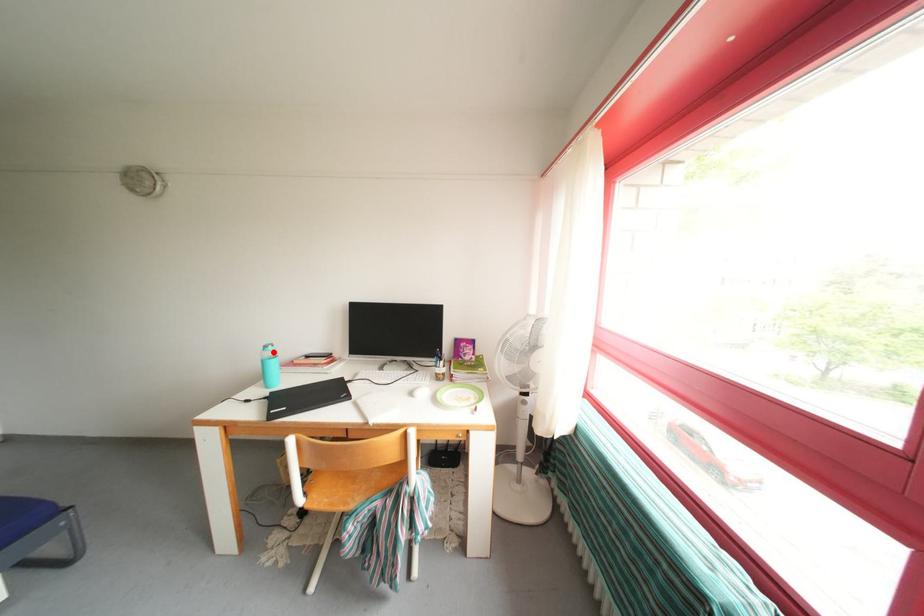
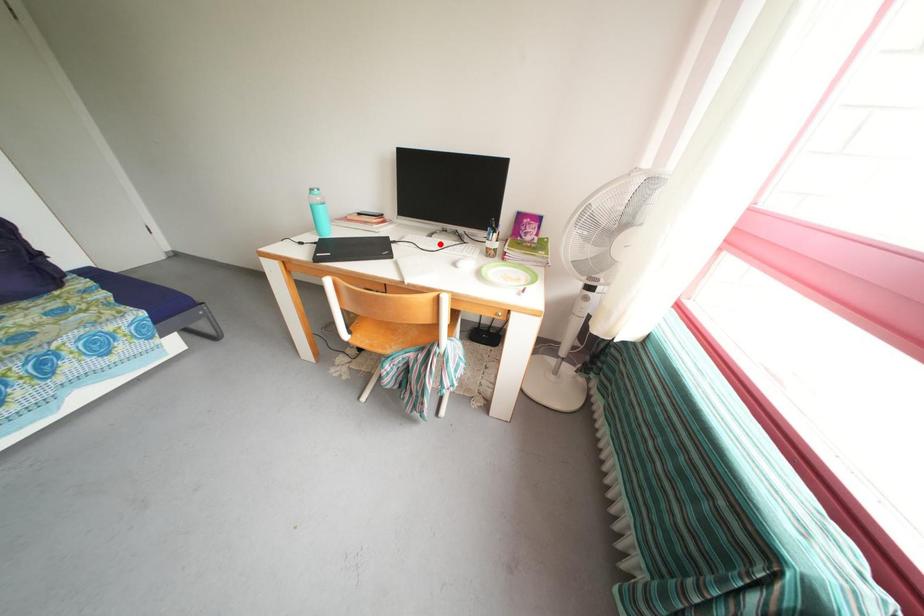
I am providing you with two images of the same scene from different viewpoints. A red point is marked on the first image and another point is marked on the second image. Are the points marked in image1 and image2 representing the same 3D position?

No